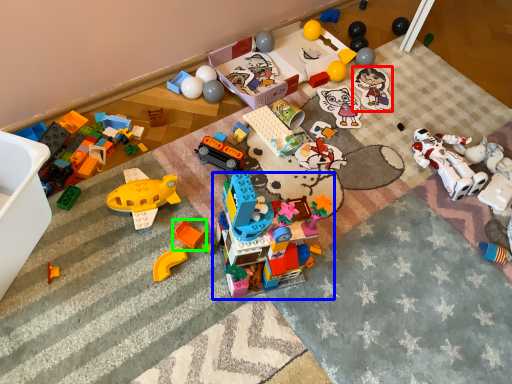
Question: Which object is positioned farthest from toy (highlighted by a red box)? Select from toy (highlighted by a blue box) and toy (highlighted by a green box).

Choices:
 (A) toy
 (B) toy

Answer: (B)